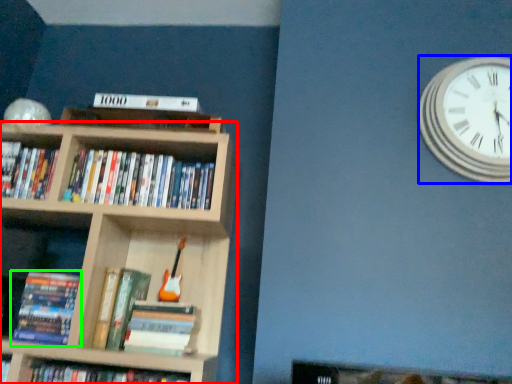
Question: Estimate the real-world distances between objects in this image. Which object is closer to bookcase (highlighted by a red box), wall clock (highlighted by a blue box) or book (highlighted by a green box)?

Choices:
 (A) wall clock
 (B) book

Answer: (B)